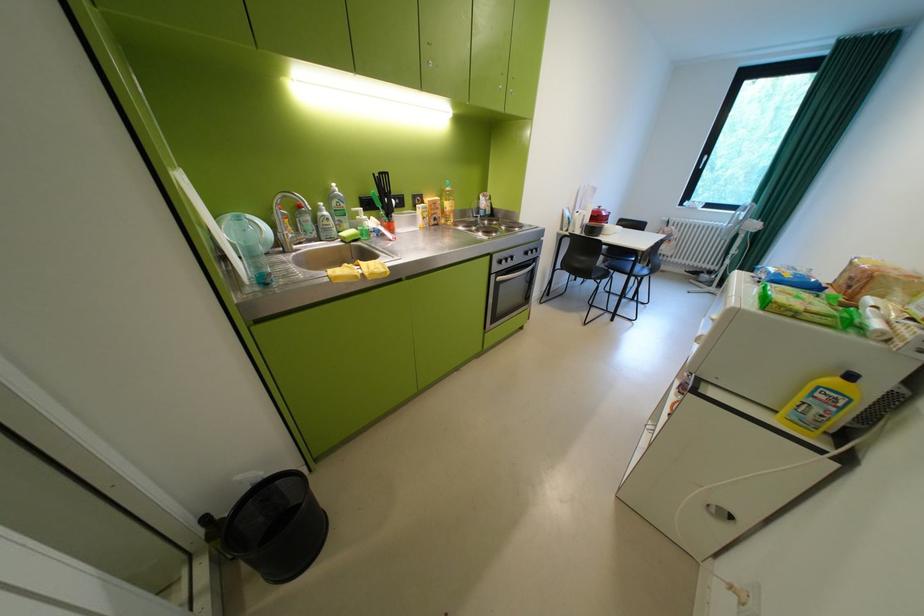
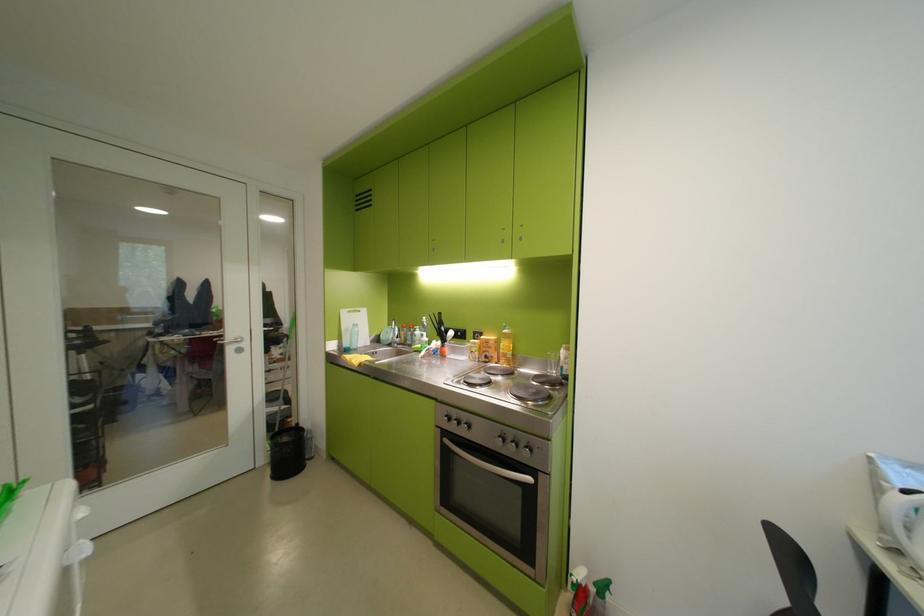
Where in the second image is the point corresponding to (x=447, y=209) from the first image?

(501, 349)